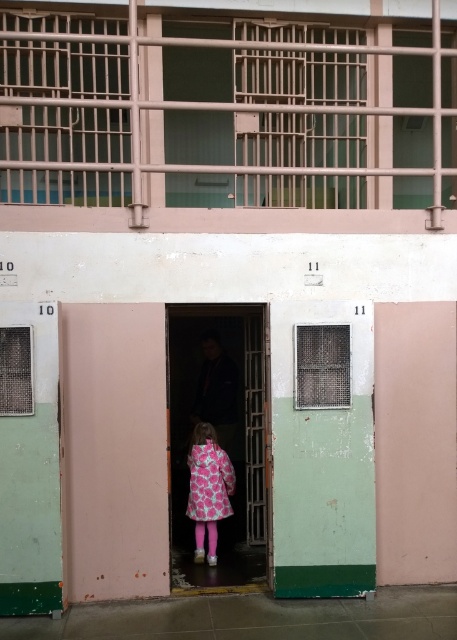
Question: Is pink fabric coat at center wider than pink floral fabric dress at center?

Choices:
 (A) yes
 (B) no

Answer: (A)

Question: Is pink fabric coat at center above pink floral fabric dress at center?

Choices:
 (A) yes
 (B) no

Answer: (A)

Question: Can you confirm if pink fabric coat at center is thinner than pink floral fabric dress at center?

Choices:
 (A) yes
 (B) no

Answer: (B)

Question: Which of the following is the closest to the observer?

Choices:
 (A) pink floral fabric dress at center
 (B) pink fabric coat at center

Answer: (B)

Question: Which of the following is the farthest from the observer?

Choices:
 (A) pink floral fabric dress at center
 (B) pink fabric coat at center

Answer: (A)